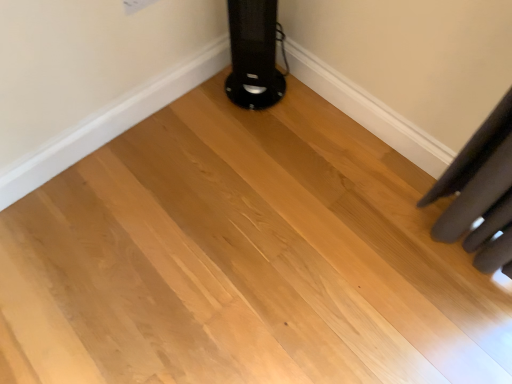
Find the location of a particular element. black plastic speaker at center is located at coordinates (254, 54).

What do you see at coordinates (254, 54) in the screenshot? I see `black plastic speaker at center` at bounding box center [254, 54].

Measure the distance between point (247, 93) and camera.

They are 1.75 meters apart.

Locate an element on the screen. black plastic speaker at center is located at coordinates coord(254,54).